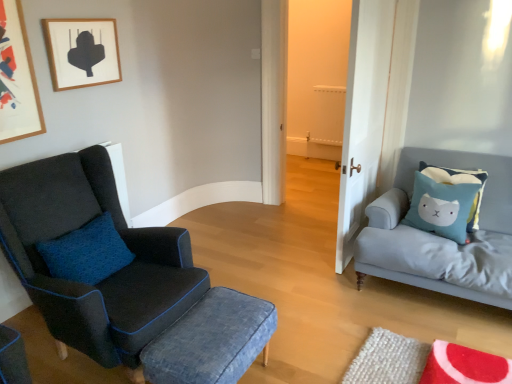
Where is `free point above wooden picture frame at upper left, the first picture frame when ordered from right to left (from a real-world perspective)`? This screenshot has height=384, width=512. free point above wooden picture frame at upper left, the first picture frame when ordered from right to left (from a real-world perspective) is located at coordinates click(76, 21).